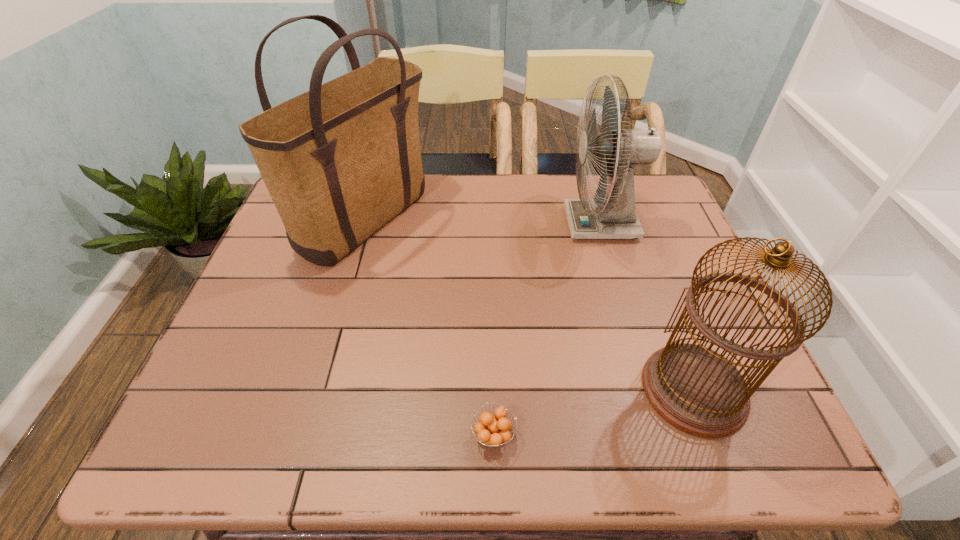
You are a GUI agent. You are given a task and a screenshot of the screen. Output one action in this format:
    pyautogui.click(x=<x>, y=<y>)
    Task: Click on the birdcage at the right edge
    
    Given the screenshot: What is the action you would take?
    pyautogui.click(x=697, y=390)

The image size is (960, 540). Find the location of `object present at the far left corner`. object present at the far left corner is located at coordinates (341, 160).

Identify the location of object that is positioned at the far right corner. (615, 217).

Where is `object that is at the near right corner`? This screenshot has height=540, width=960. object that is at the near right corner is located at coordinates (697, 390).

Image resolution: width=960 pixels, height=540 pixels. Identify the location of blank space at the far edge. pyautogui.click(x=534, y=185).

You are a GUI agent. You are given a task and a screenshot of the screen. Output one action in this format:
    pyautogui.click(x=<x>, y=<y>)
    Task: Click on the free space at the near edge
    The width and height of the screenshot is (960, 540).
    Given the screenshot: What is the action you would take?
    pyautogui.click(x=374, y=419)

The image size is (960, 540). In the image, there is a desktop. In order to click on free space at the left edge in this screenshot , I will do `click(258, 387)`.

Find the location of `vacant space at the right edge of the desktop`. vacant space at the right edge of the desktop is located at coordinates (650, 237).

The height and width of the screenshot is (540, 960). What are the coordinates of `free space at the near left corner of the desktop` in the screenshot? It's located at (245, 421).

Where is `free space at the far right corner of the desktop`? free space at the far right corner of the desktop is located at coordinates (672, 205).